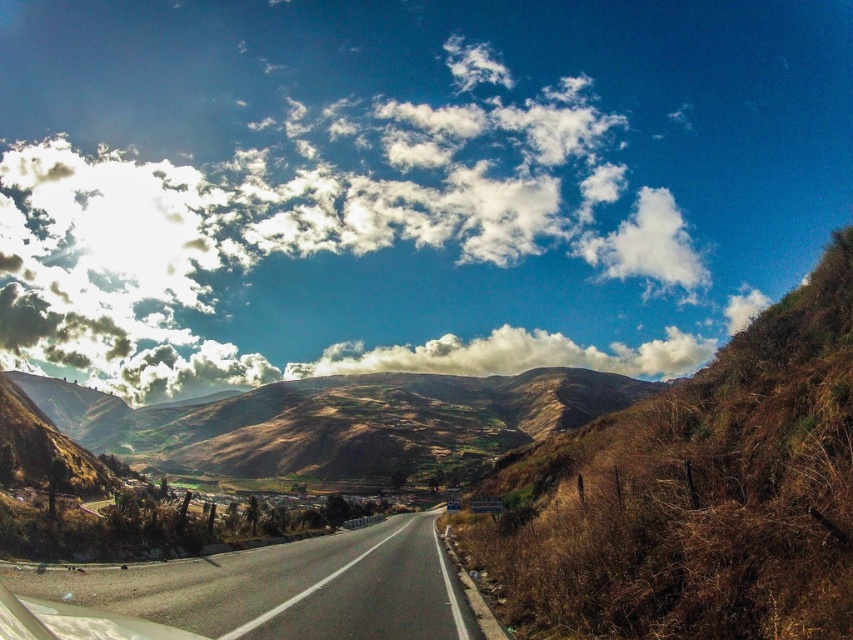
Is cloudy sky at upper center above brown textured hillside at center?

Yes.

Which is behind, point (608, 243) or point (485, 461)?

The point (608, 243) is behind.

Does point (54, 221) come behind point (525, 394)?

Yes, point (54, 221) is farther from viewer.

Find the location of a particular element. This screenshot has width=853, height=640. cloudy sky at upper center is located at coordinates (334, 236).

Who is positioned more to the right, brown grassy hill at right or brown textured hillside at center?

brown grassy hill at right is more to the right.

Which is more to the left, brown grassy hill at right or brown textured hillside at center?

brown textured hillside at center

Find the location of `brown grassy hill at right`. brown grassy hill at right is located at coordinates (698, 493).

Where is `brown grassy hill at right`? brown grassy hill at right is located at coordinates (698, 493).

Describe the element at coordinates (334, 236) in the screenshot. I see `cloudy sky at upper center` at that location.

Who is taller, cloudy sky at upper center or brown grassy hill at right?

cloudy sky at upper center is taller.

Between point (137, 390) and point (814, 516), which one is positioned in front?

Point (814, 516) is in front.

The height and width of the screenshot is (640, 853). What are the coordinates of `cloudy sky at upper center` in the screenshot? It's located at (334, 236).